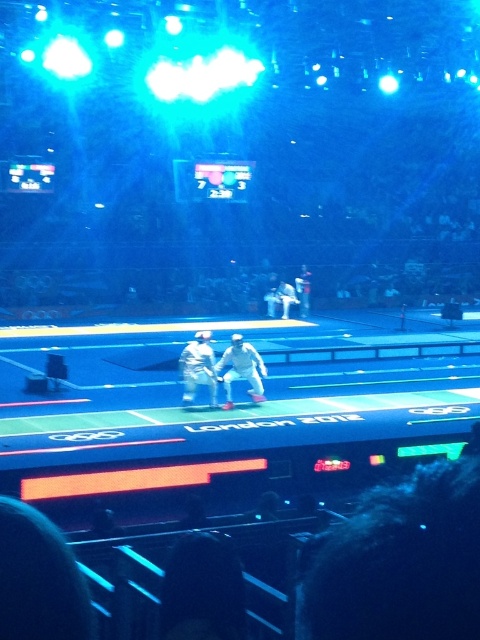
Question: Is white fabric tennis racket at center bigger than camouflage fabric uniform at center?

Choices:
 (A) yes
 (B) no

Answer: (A)

Question: Can you confirm if white fabric tennis racket at center is positioned above camouflage fabric uniform at center?

Choices:
 (A) no
 (B) yes

Answer: (A)

Question: Which point is farther to the camera?

Choices:
 (A) white fabric tennis racket at center
 (B) camouflage fabric uniform at center

Answer: (A)

Question: Does white fabric tennis racket at center appear under camouflage fabric uniform at center?

Choices:
 (A) no
 (B) yes

Answer: (B)

Question: Which object appears closest to the camera in this image?

Choices:
 (A) camouflage fabric uniform at center
 (B) white fabric tennis racket at center

Answer: (A)

Question: Which of the following is the closest to the observer?

Choices:
 (A) white fabric tennis racket at center
 (B) camouflage fabric uniform at center

Answer: (B)